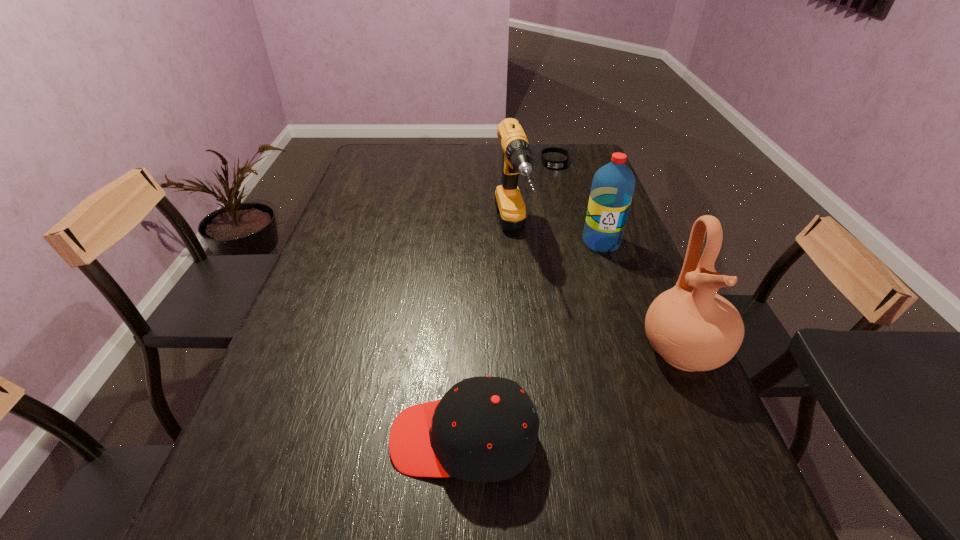
Locate an element on the screen. This screenshot has width=960, height=540. vacant space located on the display of the wristband is located at coordinates (558, 217).

Where is `free space located 0.240m on the display of the wristband`? This screenshot has width=960, height=540. free space located 0.240m on the display of the wristband is located at coordinates (558, 204).

Identify the location of vacant point located on the display of the wristband. (558, 206).

This screenshot has width=960, height=540. In order to click on vacant point located 0.340m at the tip of the drill in this screenshot , I will do `click(546, 381)`.

This screenshot has height=540, width=960. I want to click on vacant position located 0.050m at the tip of the drill, so click(520, 289).

The width and height of the screenshot is (960, 540). In order to click on vacant region located 0.380m at the tip of the drill in this screenshot , I will do `click(550, 397)`.

Where is `free region located on the front label of the water bottle`? free region located on the front label of the water bottle is located at coordinates tap(588, 288).

The height and width of the screenshot is (540, 960). I want to click on free space located on the front label of the water bottle, so click(x=582, y=315).

This screenshot has width=960, height=540. What are the coordinates of `blank space located on the front label of the water bottle` in the screenshot? It's located at (579, 326).

The width and height of the screenshot is (960, 540). What are the coordinates of `object that is at the far edge` in the screenshot? It's located at (549, 164).